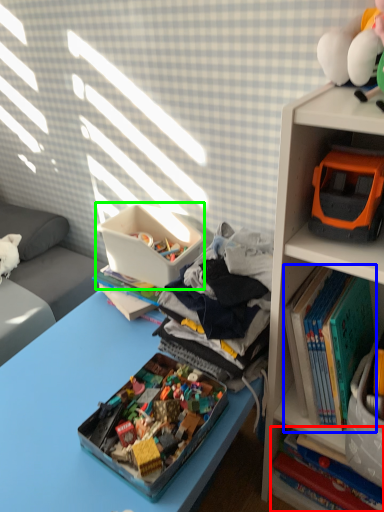
Question: Which object is positioned closest to book (highlighted by a red box)? Select from book (highlighted by a blue box) and storage box (highlighted by a green box).

Choices:
 (A) book
 (B) storage box

Answer: (A)